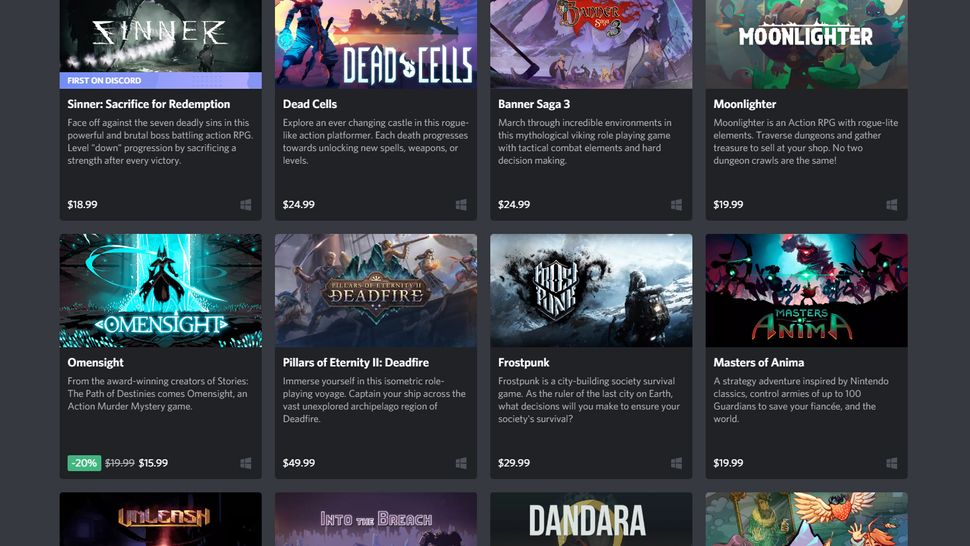
At what (x,y) coordinates should I click in order to perform the action: click on corner. Please return your answer as a coordinate pair (x, y). Looking at the image, I should click on (948, 529), (946, 11), (18, 74), (14, 529).